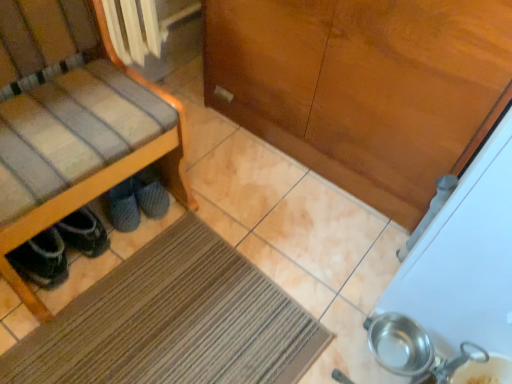
Where is `free point above brown textured mat at lower center (from a real-world perspective)`? free point above brown textured mat at lower center (from a real-world perspective) is located at coordinates (181, 329).